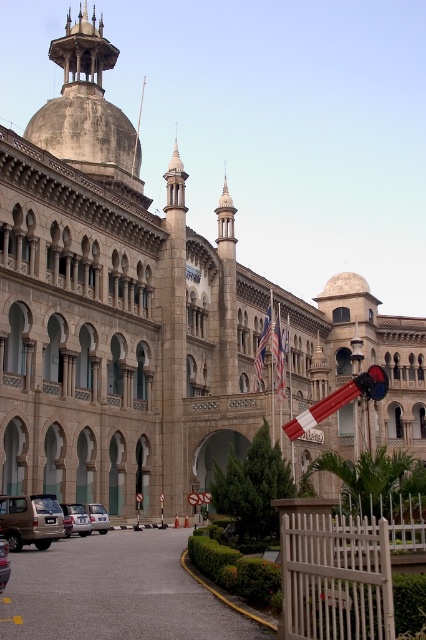
You are standing in front of the historic building and see both the american flag at center and the silver metallic car at center. Which object is closer to you?

The american flag at center is closer to you because it is further to the viewer than the silver metallic car at center.